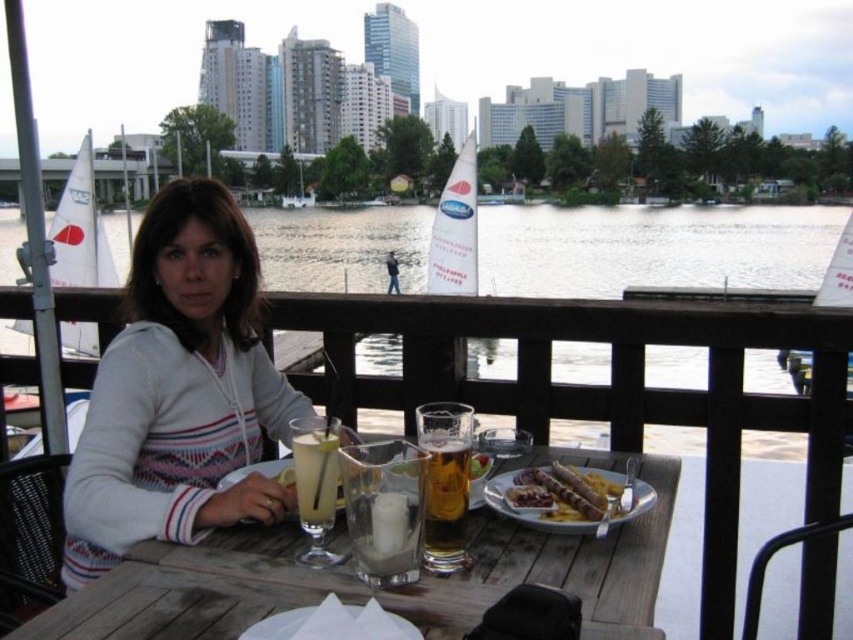
Question: Is transparent glass water at center wider than golden crispy sausages at lower center?

Choices:
 (A) no
 (B) yes

Answer: (B)

Question: Based on their relative distances, which object is nearer to the golden crispy sausages at lower center?

Choices:
 (A) clear glass at center
 (B) translucent glass beer at center
 (C) transparent glass water at center
 (D) white knitwear at center

Answer: (B)

Question: Is white knitwear at center bigger than golden crispy sausages at lower center?

Choices:
 (A) yes
 (B) no

Answer: (A)

Question: Is the position of transparent glass water at center more distant than that of clear glass at center?

Choices:
 (A) no
 (B) yes

Answer: (B)

Question: Which point is closer to the camera?

Choices:
 (A) (309, 493)
 (B) (607, 497)
 (C) (485, 424)
 (D) (257, 388)

Answer: (A)

Question: Which of the following is the farthest from the observer?

Choices:
 (A) (315, 449)
 (B) (519, 248)
 (C) (463, 561)
 (D) (563, 513)

Answer: (B)